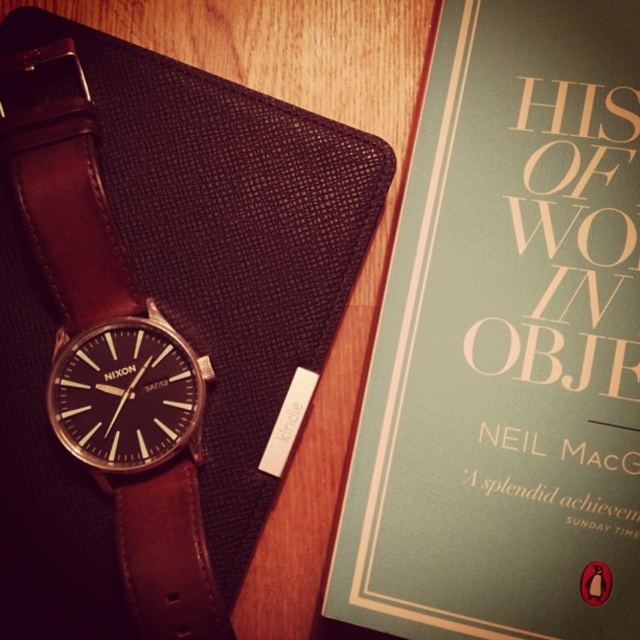
You are trying to reach the teal matte book at upper right from your current position. The book is 20.93 inches away. If your hand can extend 21 inches, can you reach it without moving?

The teal matte book at upper right is 20.93 inches away from the viewer. Since your hand can extend 21 inches, you can reach it without moving.

You are looking at the arrangement of items on the wooden surface. Which of the two points, point (x=536, y=632) or point (x=198, y=368), is closer to you?

Point (x=536, y=632) is closer to you because it is in front of point (x=198, y=368).

You are organizing items on a desk and need to know which item is closer to the edge of the desk. The scene shows a teal matte book at upper right and a brown leather strap at left. According to the arrangement, which object is closer to the edge?

The teal matte book at upper right is positioned over brown leather strap at left, meaning it is closer to the edge of the desk.